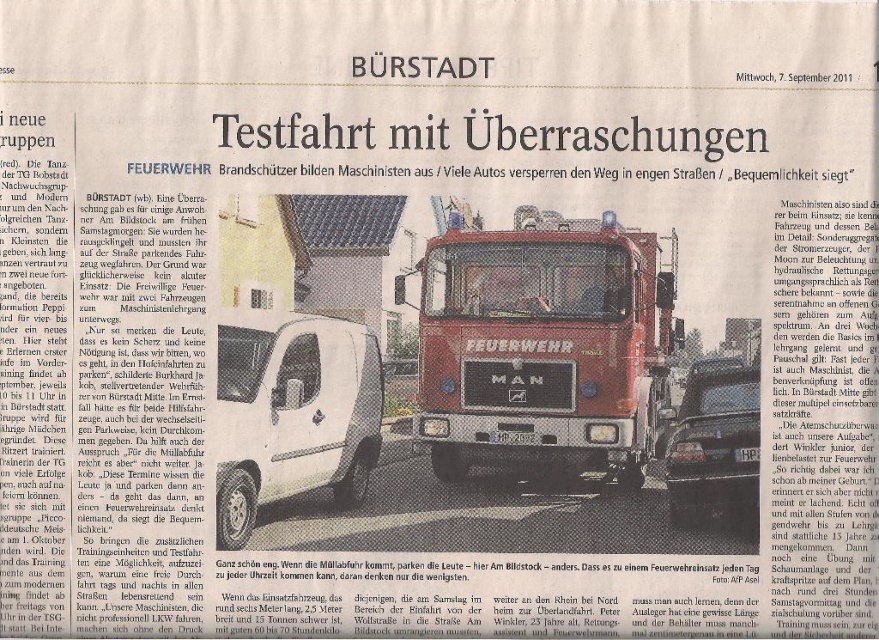
Question: Can you confirm if white matte van at center is positioned to the left of shiny black car at center?

Choices:
 (A) no
 (B) yes

Answer: (B)

Question: Which of the following is the farthest from the observer?

Choices:
 (A) (604, 228)
 (B) (342, 328)

Answer: (A)

Question: Can you confirm if white matte van at center is smaller than shiny black car at center?

Choices:
 (A) no
 (B) yes

Answer: (A)

Question: Which of the following is the farthest from the observer?

Choices:
 (A) (318, 419)
 (B) (689, 378)

Answer: (B)

Question: Can you confirm if red glossy fire truck at center is positioned below white matte van at center?

Choices:
 (A) yes
 (B) no

Answer: (B)

Question: Among these objects, which one is farthest from the camera?

Choices:
 (A) white matte van at center
 (B) shiny black car at center

Answer: (B)